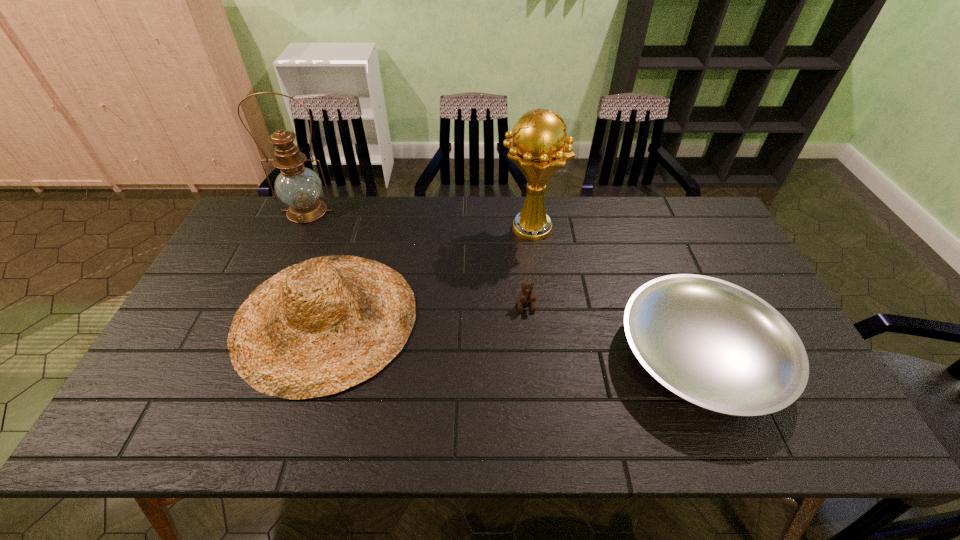
The height and width of the screenshot is (540, 960). Identify the location of vacant position at the far edge of the desktop. (335, 208).

The height and width of the screenshot is (540, 960). I want to click on vacant space at the near edge of the desktop, so click(586, 411).

In the image, there is a desktop. Where is `vacant space at the left edge`? The width and height of the screenshot is (960, 540). vacant space at the left edge is located at coordinates (263, 246).

The width and height of the screenshot is (960, 540). Identify the location of free spot at the right edge of the desktop. (716, 270).

In the image, there is a desktop. Where is `free region at the far right corner`? The image size is (960, 540). free region at the far right corner is located at coordinates (689, 219).

The width and height of the screenshot is (960, 540). I want to click on unoccupied area between the bedpan and the third shortest object, so click(513, 336).

This screenshot has width=960, height=540. Identify the location of free space between the oil lamp and the trophy_cup. (419, 219).

Identify the location of vacant point located between the trophy_cup and the teddy bear. (528, 267).

The width and height of the screenshot is (960, 540). What are the coordinates of `vacant region between the oil lamp and the teddy bear` in the screenshot? It's located at (417, 258).

Where is `blank region between the rightmost object and the trophy_cup`? blank region between the rightmost object and the trophy_cup is located at coordinates (615, 292).